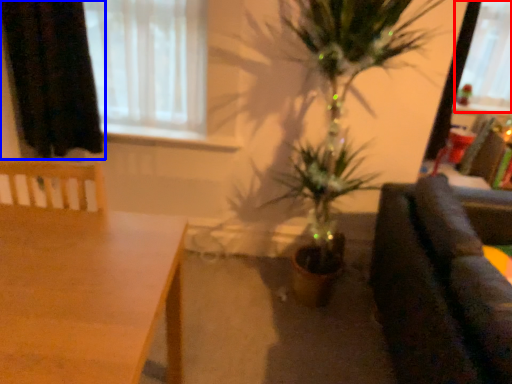
Question: Which of the following is the closest to the observer, window screen (highlighted by a red box) or curtain (highlighted by a blue box)?

Choices:
 (A) window screen
 (B) curtain

Answer: (B)